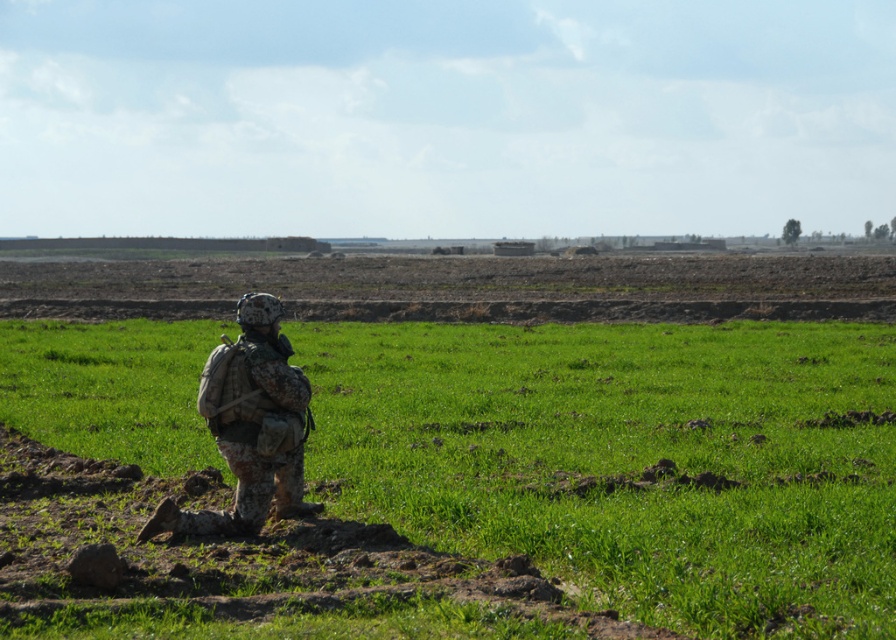
Is the position of green grass at center more distant than that of dull brown soil at center?

No, it is in front of dull brown soil at center.

Measure the distance between green grass at center and dull brown soil at center.

green grass at center and dull brown soil at center are 22.18 meters apart.

This screenshot has width=896, height=640. What do you see at coordinates (626, 460) in the screenshot?
I see `green grass at center` at bounding box center [626, 460].

At what (x,y) coordinates should I click in order to perform the action: click on green grass at center. Please return your answer as a coordinate pair (x, y). The width and height of the screenshot is (896, 640). Looking at the image, I should click on (626, 460).

Is dull brown soil at center further to camera compared to camouflage fabric soldier at center?

That is True.

Which is more to the right, dull brown soil at center or camouflage fabric soldier at center?

dull brown soil at center is more to the right.

Is point (200, 312) positioned behind point (276, 381)?

Yes, point (200, 312) is farther from viewer.

Locate an element on the screen. The width and height of the screenshot is (896, 640). dull brown soil at center is located at coordinates (461, 288).

From the picture: Between green grass at center and camouflage fabric soldier at center, which one is positioned lower?

camouflage fabric soldier at center

The image size is (896, 640). What do you see at coordinates (626, 460) in the screenshot?
I see `green grass at center` at bounding box center [626, 460].

Where is `green grass at center`? green grass at center is located at coordinates (626, 460).

The width and height of the screenshot is (896, 640). I want to click on green grass at center, so click(626, 460).